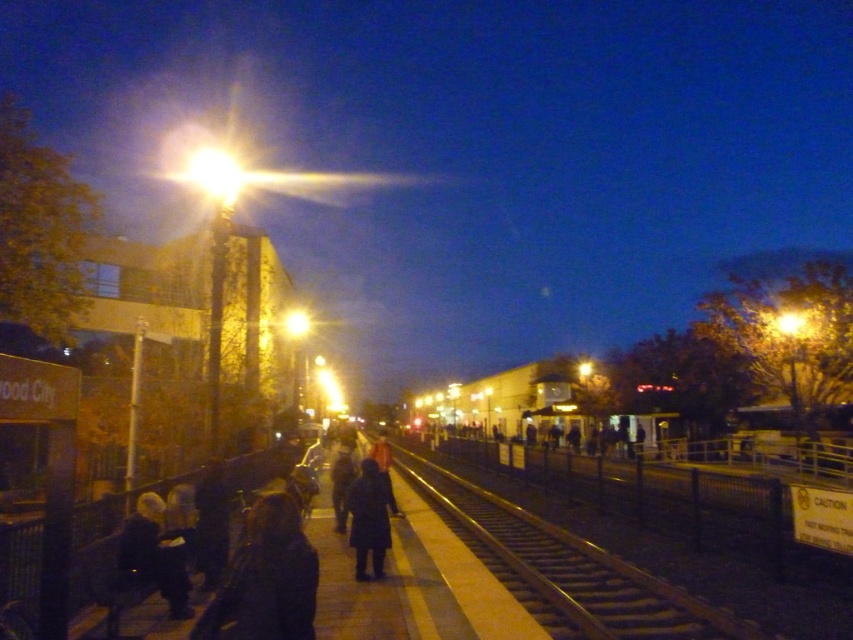
Between dark fabric coat at lower left and dark blue coat at lower left, which one is positioned higher?

Positioned higher is dark fabric coat at lower left.

Between point (250, 602) and point (158, 508), which one is positioned in front?

Point (250, 602) is in front.

You are a GUI agent. You are given a task and a screenshot of the screen. Output one action in this format:
    pyautogui.click(x=<x>, y=<y>)
    Task: Click on the dark fabric coat at lower left
    
    Given the screenshot: What is the action you would take?
    pyautogui.click(x=265, y=579)

Which of these two, dark fabric coat at lower left or dark matte coat at center, stands shorter?

With less height is dark fabric coat at lower left.

This screenshot has width=853, height=640. What are the coordinates of `dark fabric coat at lower left` in the screenshot? It's located at (265, 579).

Does point (256, 576) lie behind point (358, 522)?

No, (256, 576) is in front of (358, 522).

Identify the location of dark fabric coat at lower left. The width and height of the screenshot is (853, 640). (265, 579).

Consider the image. Between metallic smooth train track at center and dark fabric coat at lower left, which one has more height?

metallic smooth train track at center is taller.

The width and height of the screenshot is (853, 640). Describe the element at coordinates (566, 570) in the screenshot. I see `metallic smooth train track at center` at that location.

The height and width of the screenshot is (640, 853). In order to click on metallic smooth train track at center in this screenshot , I will do `click(566, 570)`.

Locate an element on the screen. Image resolution: width=853 pixels, height=640 pixels. metallic smooth train track at center is located at coordinates 566,570.